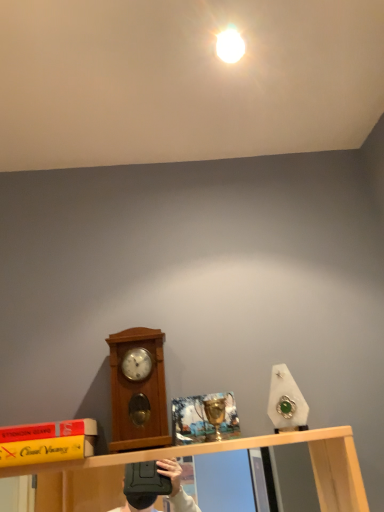
Identify the location of vacant space to the left of white glossy light bulb at upper center. (165, 62).